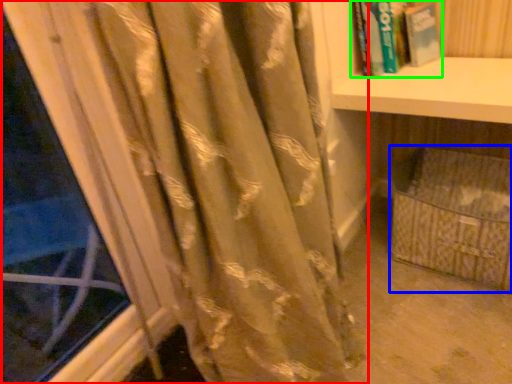
Question: Which object is positioned closest to curtain (highlighted by a red box)? Select from basket (highlighted by a blue box) and book (highlighted by a green box).

Choices:
 (A) basket
 (B) book

Answer: (A)